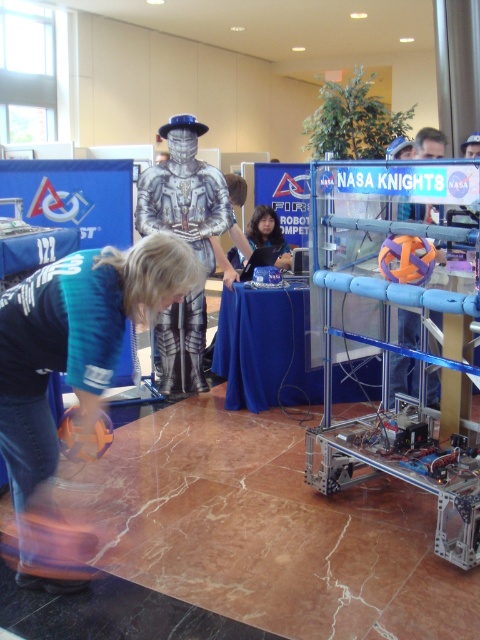
Question: Among these objects, which one is farthest from the camera?

Choices:
 (A) blue denim jeans at lower left
 (B) orange matte ball at center
 (C) smooth black hair at center
 (D) silver metallic armor at center

Answer: (C)

Question: Is orange matte ball at center positioned at the back of smooth black hair at center?

Choices:
 (A) no
 (B) yes

Answer: (A)

Question: Which object is the closest to the blue denim jeans at lower left?

Choices:
 (A) silver metallic armor at center
 (B) smooth black hair at center

Answer: (A)

Question: Where is blue denim jeans at lower left located in relation to smooth black hair at center in the image?

Choices:
 (A) left
 (B) right

Answer: (A)

Question: Is blue denim jeans at lower left above orange matte ball at center?

Choices:
 (A) yes
 (B) no

Answer: (B)

Question: Which point is farther to the camera?

Choices:
 (A) smooth black hair at center
 (B) blue denim jeans at lower left
 (C) orange matte ball at center

Answer: (A)